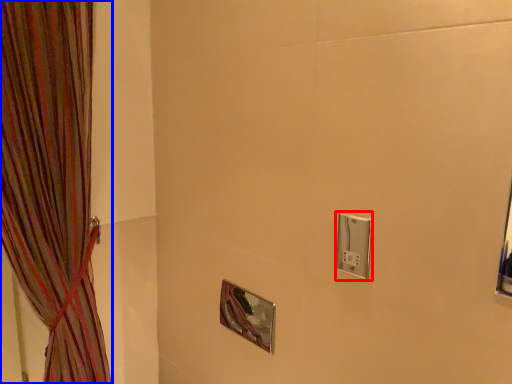
Question: Which object appears closest to the camera in this image, light switch (highlighted by a red box) or curtain (highlighted by a blue box)?

Choices:
 (A) light switch
 (B) curtain

Answer: (B)